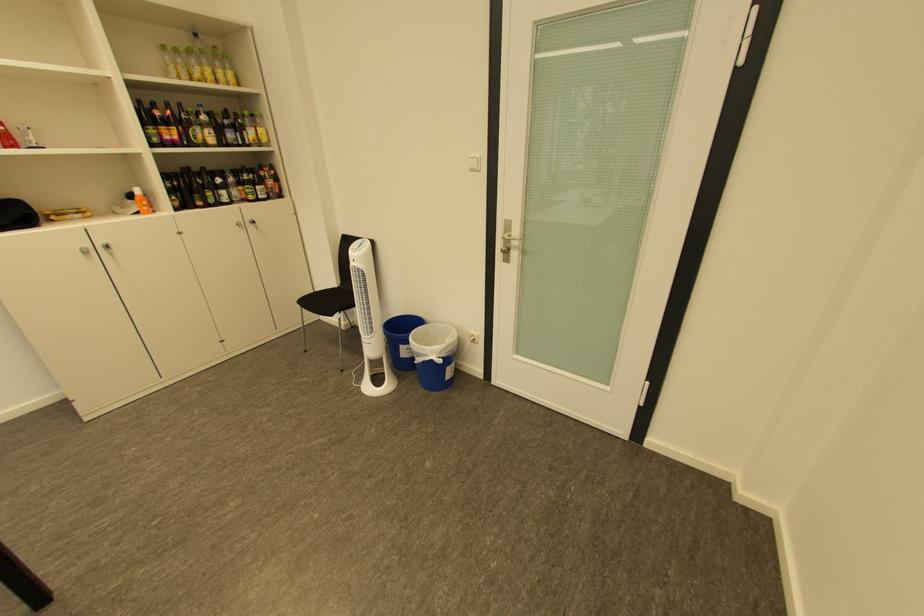
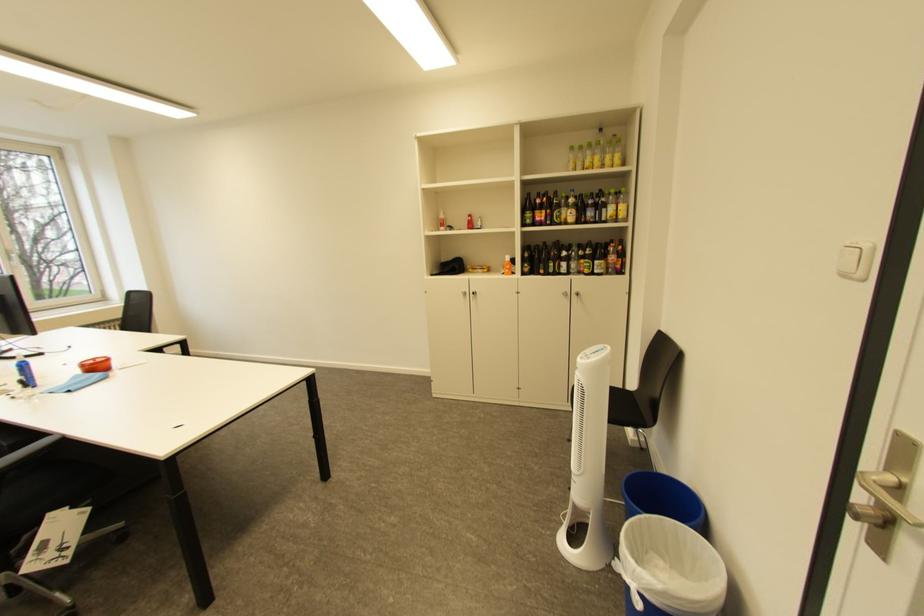
Find the pixel in the second image that matches (x=190, y=50) in the first image.

(596, 146)